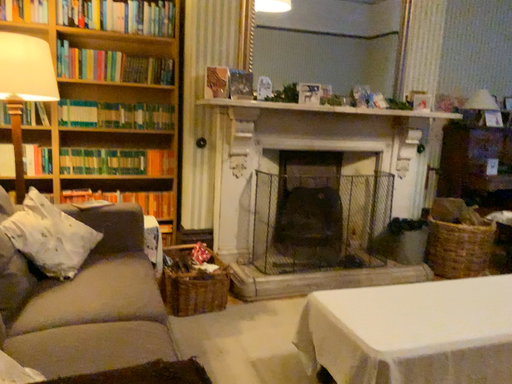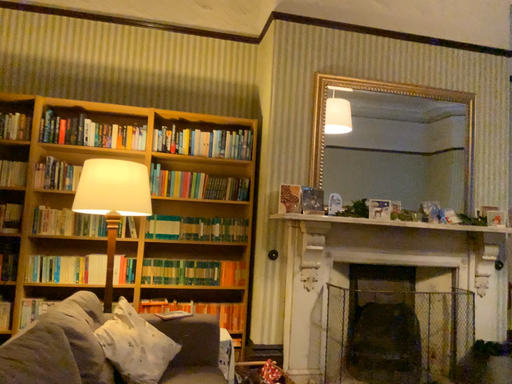
Question: How did the camera likely rotate when shooting the video?

Choices:
 (A) rotated left
 (B) rotated right

Answer: (A)